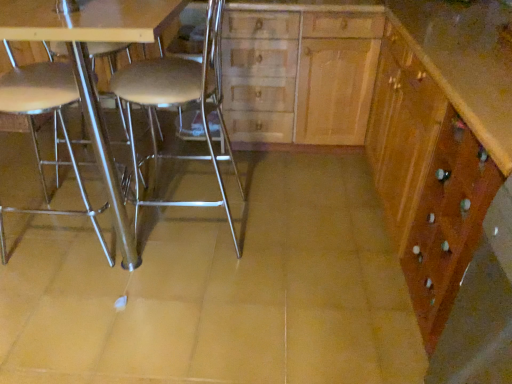
You are a GUI agent. You are given a task and a screenshot of the screen. Output one action in this format:
    pyautogui.click(x=<x>, y=<y>)
    Task: Click on the unoccupied space behind metallic silver stool at center, the first chair from the right
    The width and height of the screenshot is (512, 384).
    Given the screenshot: What is the action you would take?
    pyautogui.click(x=196, y=182)